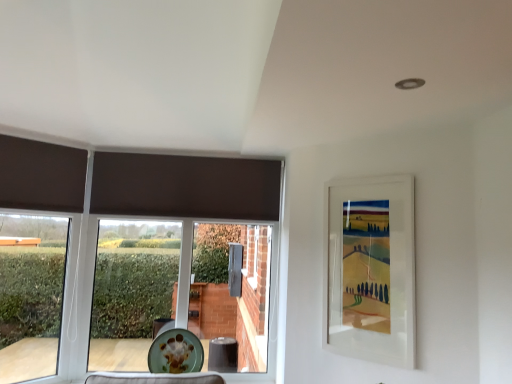
Question: Could you tell me if white matte picture frame at upper right is turned towards matte brown curtain at left?

Choices:
 (A) no
 (B) yes

Answer: (A)

Question: Does white matte picture frame at upper right come behind matte brown curtain at left?

Choices:
 (A) no
 (B) yes

Answer: (A)

Question: Is white matte picture frame at upper right outside matte brown curtain at left?

Choices:
 (A) no
 (B) yes

Answer: (B)

Question: From the image's perspective, is white matte picture frame at upper right on top of matte brown curtain at left?

Choices:
 (A) no
 (B) yes

Answer: (B)

Question: From a real-world perspective, is white matte picture frame at upper right physically below matte brown curtain at left?

Choices:
 (A) no
 (B) yes

Answer: (A)

Question: Considering the relative sizes of white matte picture frame at upper right and matte brown curtain at left in the image provided, is white matte picture frame at upper right shorter than matte brown curtain at left?

Choices:
 (A) yes
 (B) no

Answer: (A)

Question: Does matte brown curtain at left have a greater width compared to green glazed plate at lower center?

Choices:
 (A) no
 (B) yes

Answer: (A)

Question: Considering the relative sizes of matte brown curtain at left and green glazed plate at lower center in the image provided, is matte brown curtain at left taller than green glazed plate at lower center?

Choices:
 (A) no
 (B) yes

Answer: (B)

Question: Is matte brown curtain at left shorter than green glazed plate at lower center?

Choices:
 (A) yes
 (B) no

Answer: (B)

Question: Can you confirm if matte brown curtain at left is thinner than green glazed plate at lower center?

Choices:
 (A) no
 (B) yes

Answer: (B)

Question: Could green glazed plate at lower center be considered to be inside matte brown curtain at left?

Choices:
 (A) no
 (B) yes

Answer: (A)

Question: From a real-world perspective, is matte brown curtain at left positioned under green glazed plate at lower center based on gravity?

Choices:
 (A) yes
 (B) no

Answer: (B)

Question: From the image's perspective, is green glazed plate at lower center below white matte picture frame at upper right?

Choices:
 (A) no
 (B) yes

Answer: (B)